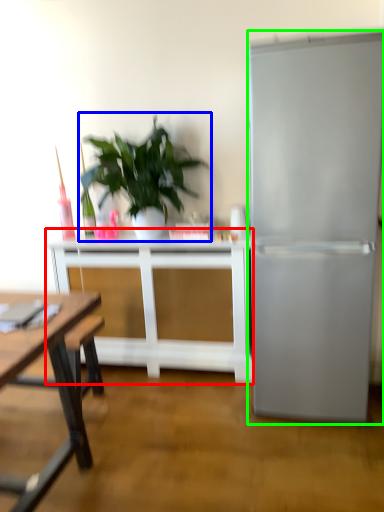
Question: Which is farther away from table (highlighted by a red box)? houseplant (highlighted by a blue box) or refrigerator (highlighted by a green box)?

Choices:
 (A) houseplant
 (B) refrigerator

Answer: (B)